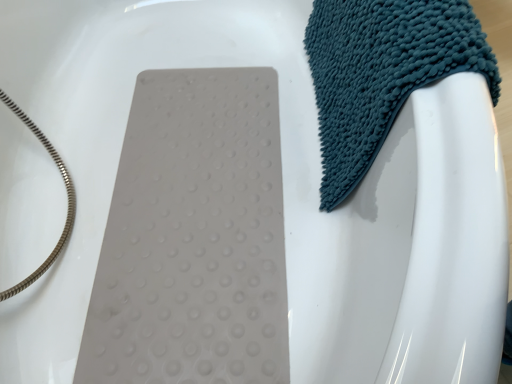
The height and width of the screenshot is (384, 512). Describe the element at coordinates (67, 196) in the screenshot. I see `metallic silver hose at left` at that location.

Locate an element on the screen. Image resolution: width=512 pixels, height=384 pixels. metallic silver hose at left is located at coordinates (67, 196).

Measure the distance between metallic silver hose at left and camera.

metallic silver hose at left and camera are 30.71 inches apart.

Locate an element on the screen. The width and height of the screenshot is (512, 384). metallic silver hose at left is located at coordinates (67, 196).